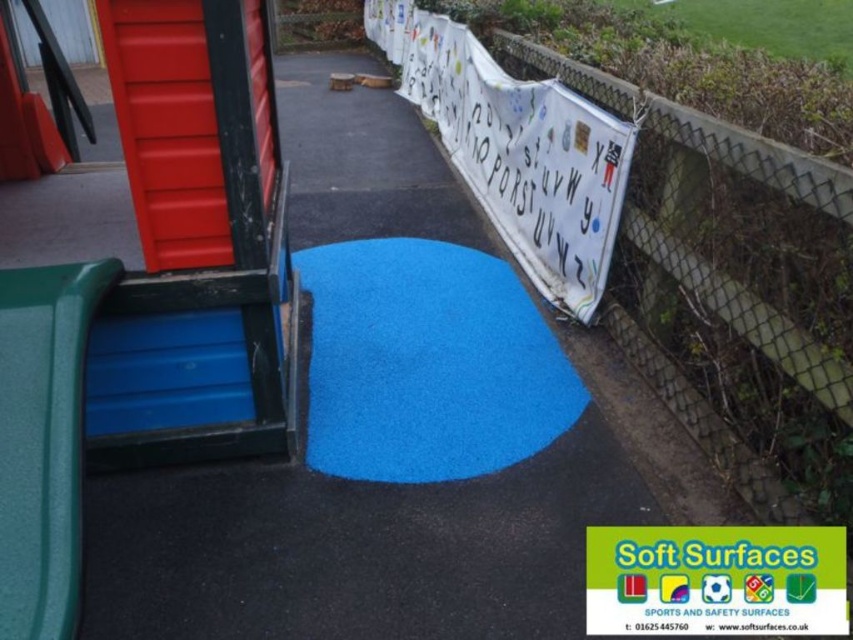
You are standing at the edge of the playground and want to place a 6 feet long ladder diagonally across the blue rubber mat at center. Can you fit the ladder on the mat without it extending beyond the mat?

The blue rubber mat at center is positioned 5.91 feet away from the viewer. Since the ladder is 6 feet long, placing it diagonally may exceed the mat dimensions. However, without knowing the mat size, we can only confirm the distance from the viewer. Thus, it is uncertain if the ladder will fit without extending beyond the mat.

You are a parent trying to place a new toy box between the blue rubber mat at center and the green textured slide at left. The toy box requires 1.2 meters of space. Can the available space between them accommodate the toy box?

The blue rubber mat at center is wider than the green textured slide at left, but the description does not provide exact measurements of the space between them. Therefore, it is uncertain if the 1.2 meters required for the toy box is available.